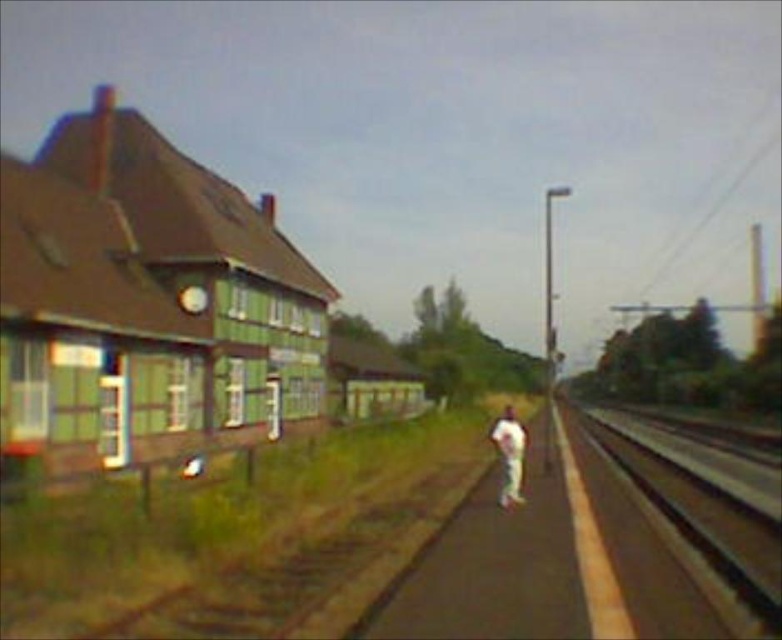
Is smooth asphalt train track at right above white cotton pants at center?

Yes, smooth asphalt train track at right is above white cotton pants at center.

Looking at this image, is smooth asphalt train track at right thinner than white cotton pants at center?

No, smooth asphalt train track at right is not thinner than white cotton pants at center.

Between point (770, 541) and point (508, 468), which one is positioned behind?

Point (508, 468)

At what (x,y) coordinates should I click in order to perform the action: click on smooth asphalt train track at right. Please return your answer as a coordinate pair (x, y). The image size is (782, 640). Looking at the image, I should click on (698, 524).